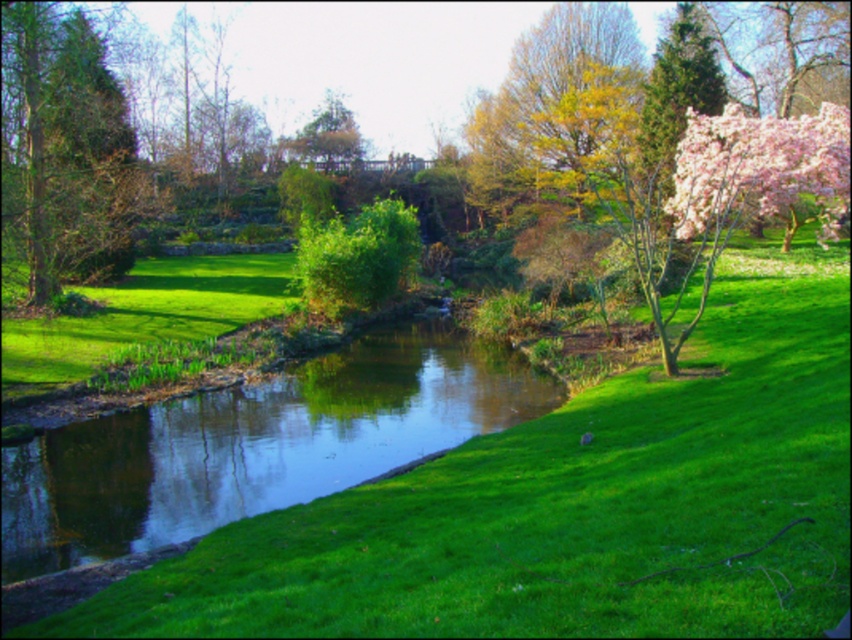
Question: Is green grassy at center to the left of green leafy tree at upper center from the viewer's perspective?

Choices:
 (A) no
 (B) yes

Answer: (A)

Question: Can you confirm if green grassy at center is positioned below yellow-green foliage at upper center?

Choices:
 (A) no
 (B) yes

Answer: (B)

Question: Which point appears closest to the camera in this image?

Choices:
 (A) (329, 93)
 (B) (410, 492)

Answer: (B)

Question: Which point is farther to the camera?

Choices:
 (A) green leafy tree at upper center
 (B) green textured tree at left
 (C) green grassy at center

Answer: (A)

Question: Can you confirm if green grassy at center is smaller than green textured tree at left?

Choices:
 (A) no
 (B) yes

Answer: (B)

Question: Which point is farther to the camera?

Choices:
 (A) yellow-green foliage at upper center
 (B) green grassy at center
 (C) green leafy tree at upper center
 (D) green textured tree at left

Answer: (C)